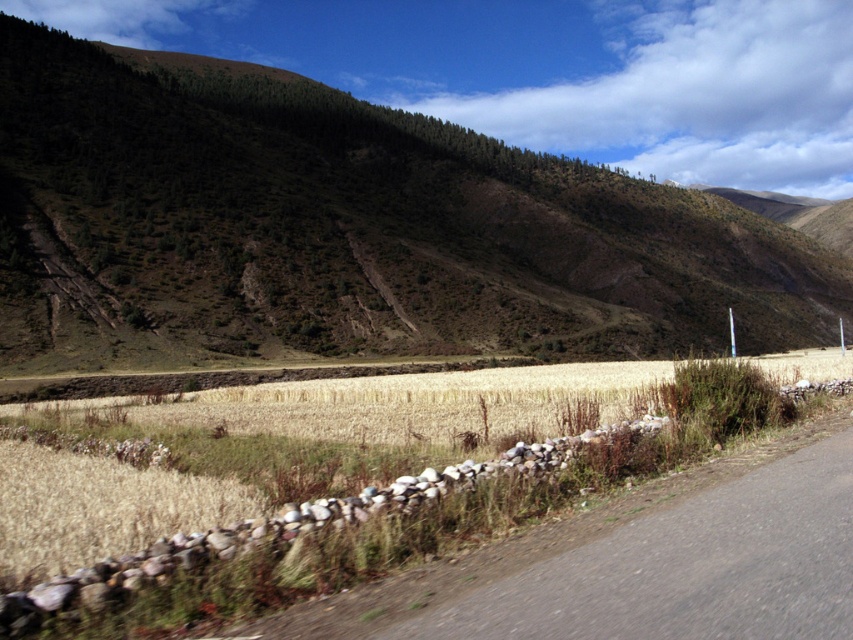
Identify the location of green textured hillside at upper left. (346, 228).

Is point (30, 300) positioned in front of point (471, 564)?

No, it is not.

Is point (132, 307) positioned behind point (467, 616)?

Yes, point (132, 307) is behind point (467, 616).

Where is `green textured hillside at upper left`? green textured hillside at upper left is located at coordinates (346, 228).

Who is more distant from viewer, (405, 236) or (277, 400)?

The point (405, 236) is behind.

Can you confirm if green textured hillside at upper left is positioned above golden grain field at center?

Indeed, green textured hillside at upper left is positioned over golden grain field at center.

Who is more distant from viewer, (836, 310) or (798, 355)?

Point (836, 310)

Where is `green textured hillside at upper left`? green textured hillside at upper left is located at coordinates (346, 228).

Does point (712, 627) come in front of point (335, 432)?

Yes, it is.

Between gray asphalt road at lower right and golden grain field at center, which one has more height?

With more height is golden grain field at center.

What do you see at coordinates (663, 557) in the screenshot? I see `gray asphalt road at lower right` at bounding box center [663, 557].

At what (x,y) coordinates should I click in order to perform the action: click on gray asphalt road at lower right. Please return your answer as a coordinate pair (x, y). This screenshot has width=853, height=640. Looking at the image, I should click on (663, 557).